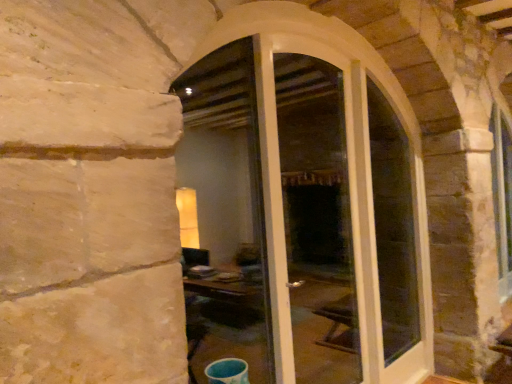
Locate an element on the screen. The width and height of the screenshot is (512, 384). free space above white glossy screen door at center (from a real-world perspective) is located at coordinates (312, 37).